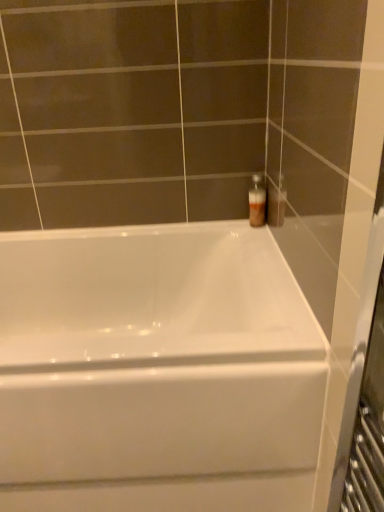
Question: Considering the positions of point (251, 179) and point (31, 366), is point (251, 179) closer or farther from the camera than point (31, 366)?

Choices:
 (A) farther
 (B) closer

Answer: (A)

Question: From a real-world perspective, is translucent plastic bottle at upper right above or below white glossy bathtub at center?

Choices:
 (A) below
 (B) above

Answer: (B)

Question: In the image, is translucent plastic bottle at upper right on the left side or the right side of white glossy bathtub at center?

Choices:
 (A) left
 (B) right

Answer: (B)

Question: In terms of size, does white glossy bathtub at center appear bigger or smaller than translucent plastic bottle at upper right?

Choices:
 (A) small
 (B) big

Answer: (B)

Question: Looking at their shapes, would you say white glossy bathtub at center is wider or thinner than translucent plastic bottle at upper right?

Choices:
 (A) thin
 (B) wide

Answer: (B)

Question: Relative to translucent plastic bottle at upper right, is white glossy bathtub at center in front or behind?

Choices:
 (A) behind
 (B) front

Answer: (B)

Question: Which is correct: white glossy bathtub at center is inside translucent plastic bottle at upper right, or outside of it?

Choices:
 (A) inside
 (B) outside

Answer: (B)